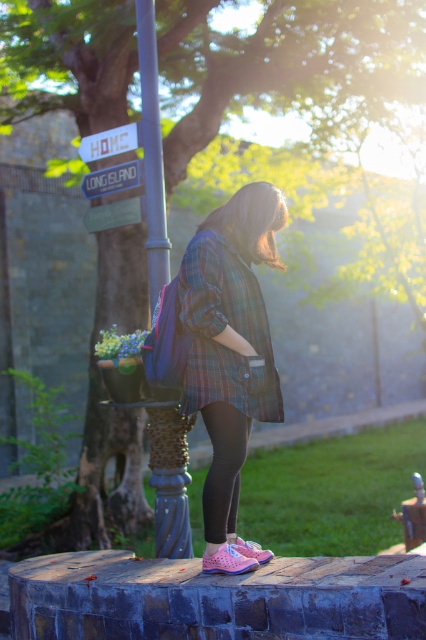
Question: Which point is farther from the camera taking this photo?

Choices:
 (A) (238, 332)
 (B) (161, 246)

Answer: (B)

Question: Can you confirm if white plastic sign at upper center is positioned above green painted metal street sign at upper left?

Choices:
 (A) yes
 (B) no

Answer: (A)

Question: From the image, what is the correct spatial relationship of black leggings at lower center in relation to green painted metal street sign at upper left?

Choices:
 (A) below
 (B) above

Answer: (A)

Question: Which of these objects is positioned farthest from the plaid fabric shirt at center?

Choices:
 (A) green painted metal street sign at upper left
 (B) plaid fabric jacket at center

Answer: (A)

Question: Which object is farther from the camera taking this photo?

Choices:
 (A) blue plastic sign at upper center
 (B) green painted metal street sign at upper left
 (C) black leggings at lower center
 (D) plaid fabric jacket at center

Answer: (A)

Question: Is plaid fabric jacket at center bigger than blue plastic sign at upper center?

Choices:
 (A) yes
 (B) no

Answer: (A)